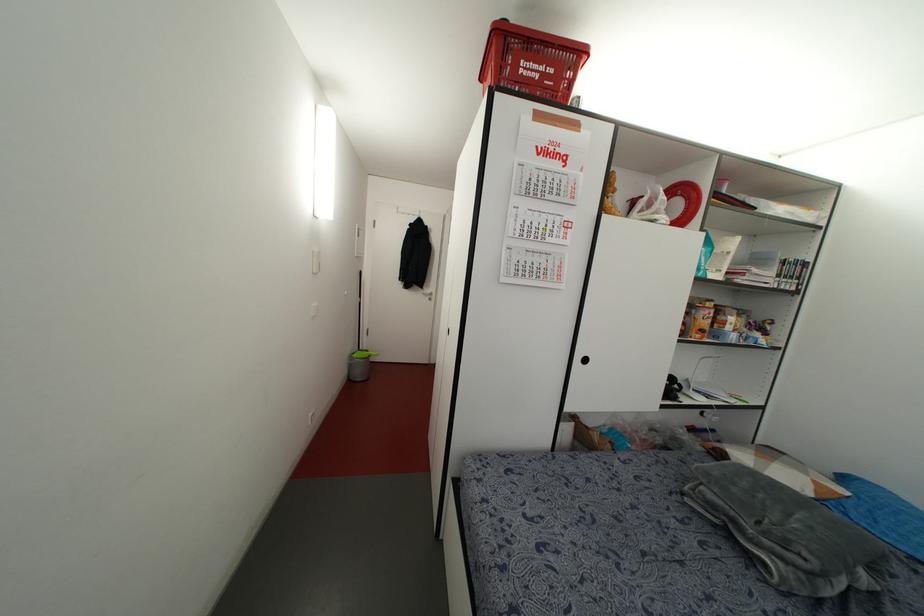
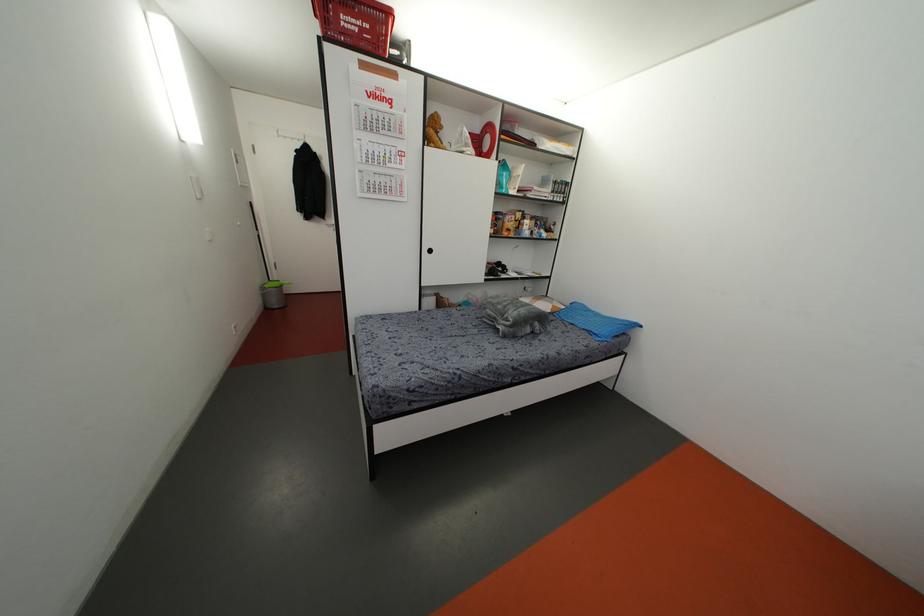
Where in the second image is the point corresponding to point 700,330 from the first image?

(507, 229)